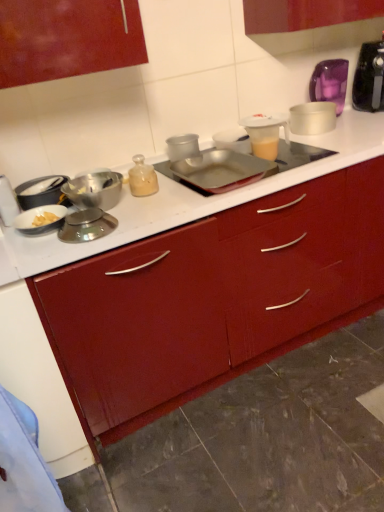
I want to click on free space that is in between translucent plastic mixer at upper right and purple glass jar at upper right, which is the second appliance in bottom-to-top order, so click(355, 116).